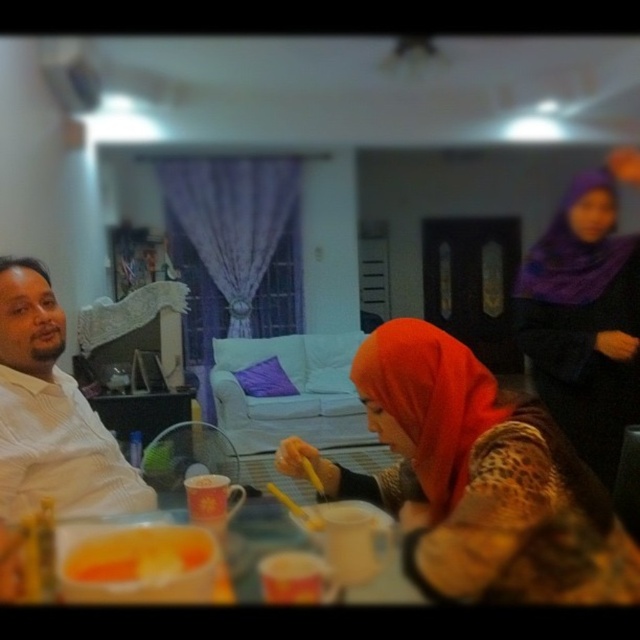
You are standing in the living room and see the image. There is a point at coordinates (476, 481). What object is located at that point?

The object at point (476, 481) is the matte orange hijab at center.

You are a photographer trying to capture a closeup of the purple satin hijab at upper right and the yellow matte food at lower left. Since the camera can only focus on one object at a time, which object should you focus on to ensure it appears larger in the photo?

The purple satin hijab at upper right is bigger than the yellow matte food at lower left, so focusing on the purple satin hijab at upper right will make it appear larger in the photo.

You are a guest at this gathering and want to reach for the yellow matte food at lower left without touching the matte orange hijab at center. Is this possible?

The matte orange hijab at center is located above the yellow matte food at lower left, so you can reach for the yellow matte food at lower left by moving your hand under the hijab without touching it.